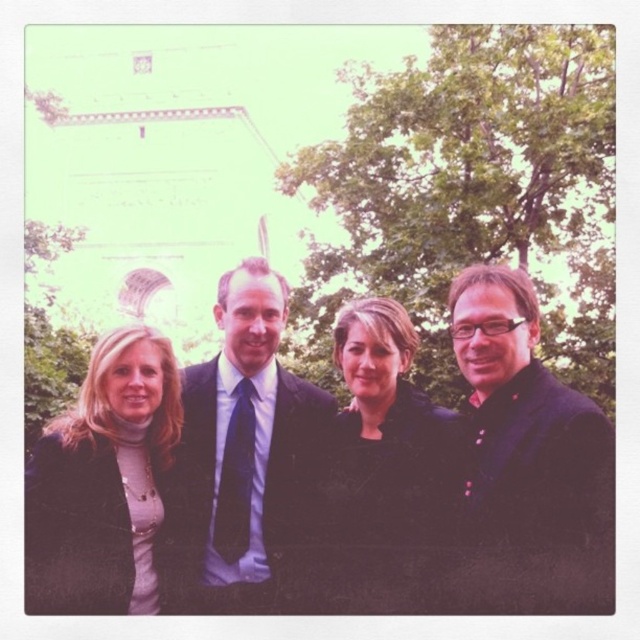
Question: Which object is closer to the camera taking this photo?

Choices:
 (A) matte black jacket at center
 (B) matte black jacket at left

Answer: (A)

Question: Which point is farther to the camera?

Choices:
 (A) (248, 556)
 (B) (136, 515)
 (C) (412, 540)

Answer: (A)

Question: Does black matte suit at center have a smaller size compared to matte black jacket at left?

Choices:
 (A) no
 (B) yes

Answer: (A)

Question: Estimate the real-world distances between objects in this image. Which object is closer to the matte black suit at center?

Choices:
 (A) black matte suit at center
 (B) matte black jacket at center
 (C) matte black jacket at left
 (D) black matte jacket at center

Answer: (A)

Question: Is matte black suit at center positioned in front of matte black jacket at left?

Choices:
 (A) no
 (B) yes

Answer: (A)

Question: Is matte black jacket at center thinner than matte black suit at center?

Choices:
 (A) no
 (B) yes

Answer: (B)